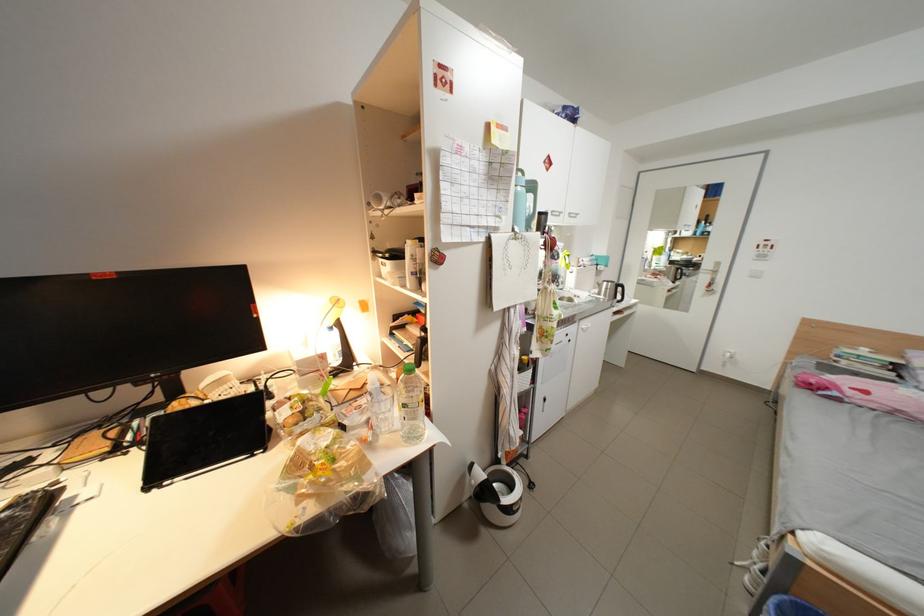
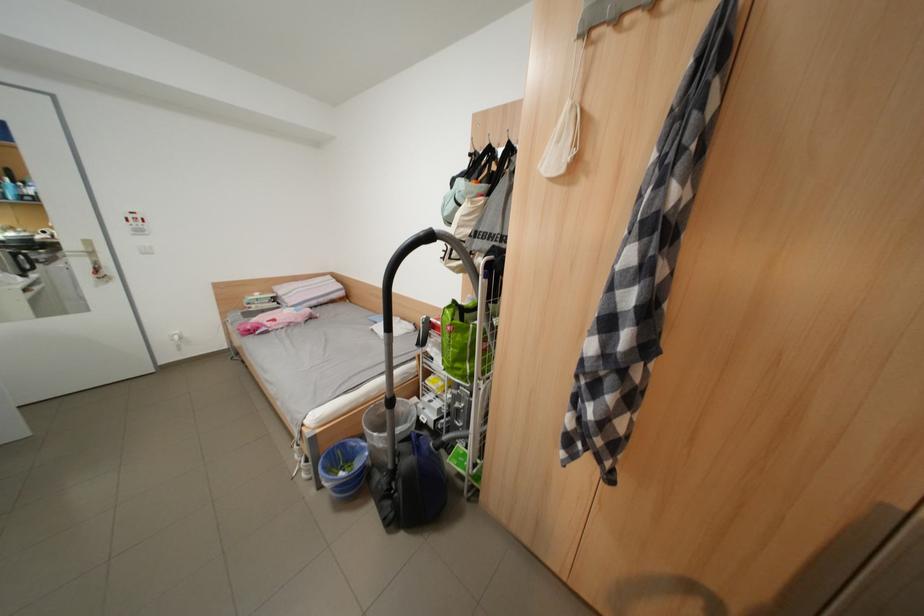
Locate, in the second image, the point that corresponds to point 773,257 in the first image.

(152, 233)